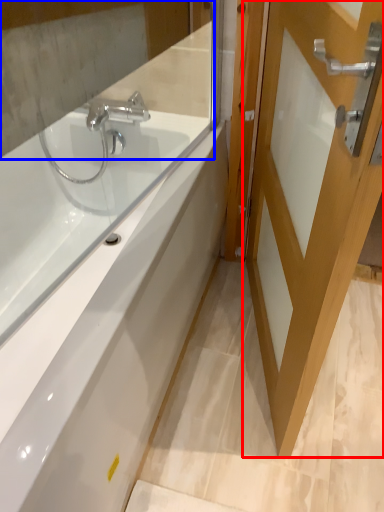
Question: Among these objects, which one is nearest to the camera, door (highlighted by a red box) or mirror (highlighted by a blue box)?

Choices:
 (A) door
 (B) mirror

Answer: (A)